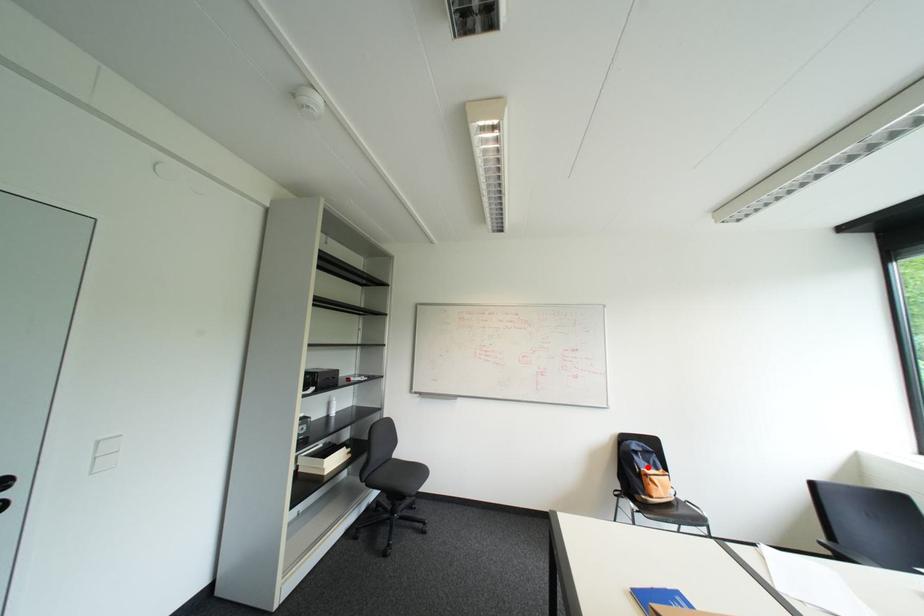
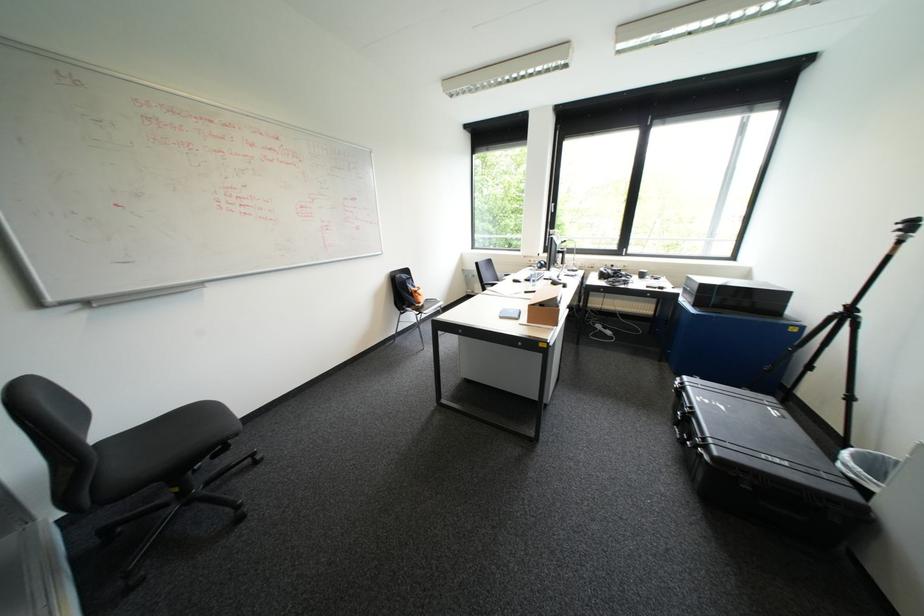
Where in the second image is the point corresponding to the highlighted location from the first image?

(419, 288)